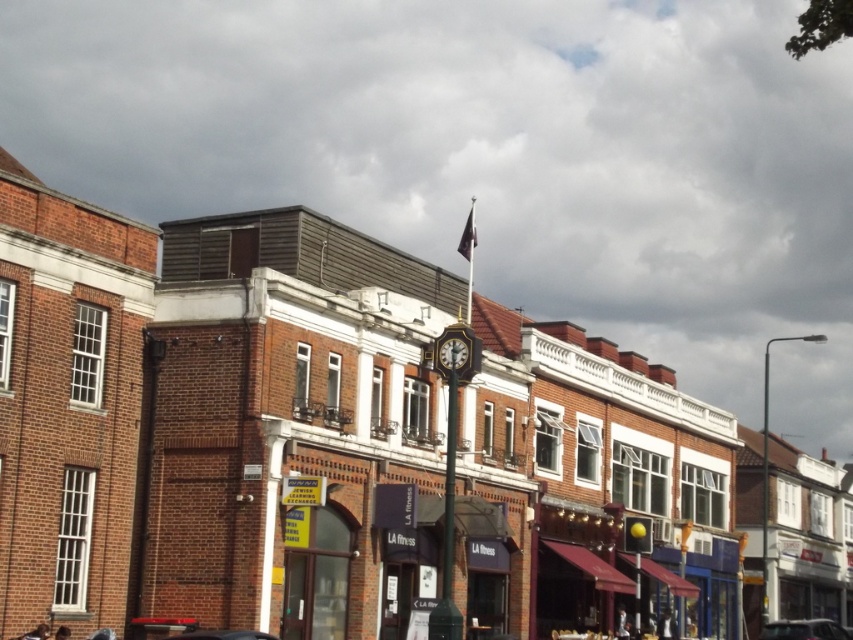
Between metallic silver car at lower right and gold metallic clock at center, which one appears on the right side from the viewer's perspective?

From the viewer's perspective, metallic silver car at lower right appears more on the right side.

Which is behind, point (770, 625) or point (468, 364)?

Positioned behind is point (770, 625).

What do you see at coordinates (804, 628) in the screenshot? I see `metallic silver car at lower right` at bounding box center [804, 628].

At what (x,y) coordinates should I click in order to perform the action: click on metallic silver car at lower right. Please return your answer as a coordinate pair (x, y). Looking at the image, I should click on (804, 628).